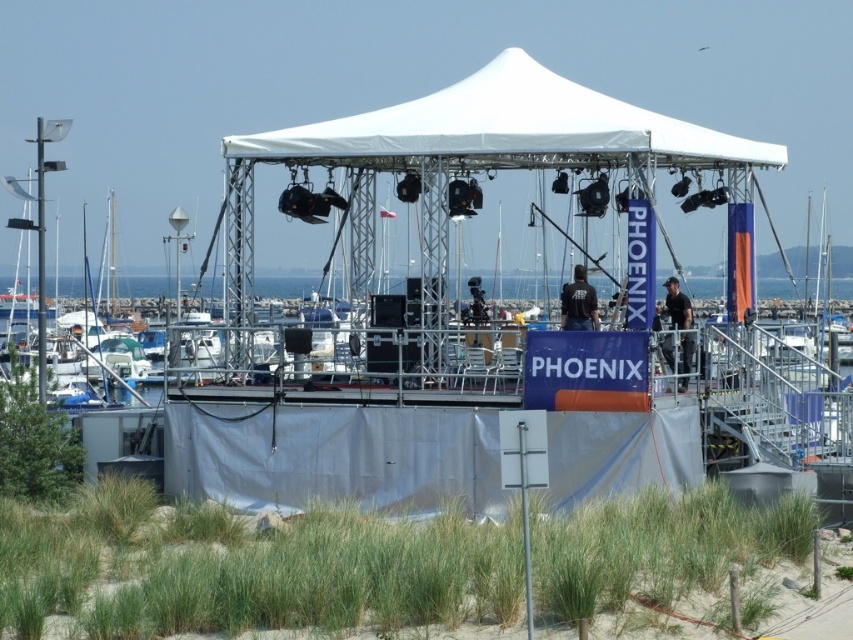
You are a stagehand who needs to hang a large banner above the stage. The banner requires a minimum height of 5 meters to avoid touching the ground. Given the white fabric canopy at center and blue water at center, which object can you safely attach the banner to without violating the height requirement?

The white fabric canopy at center has a greater height compared to blue water at center, so you should attach the banner to the white fabric canopy at center to meet the minimum height requirement of 5 meters.